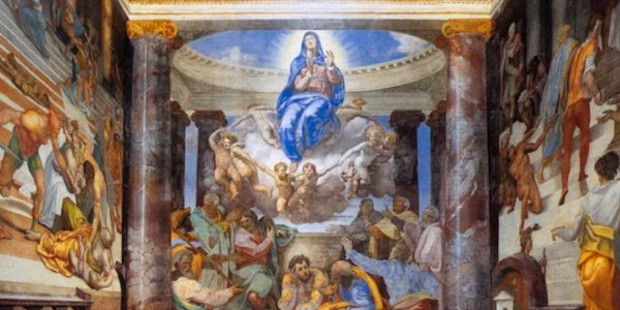
This screenshot has width=620, height=310. Identify the location of pillar. (471, 121), (435, 133), (407, 134), (203, 128), (180, 139), (159, 155).